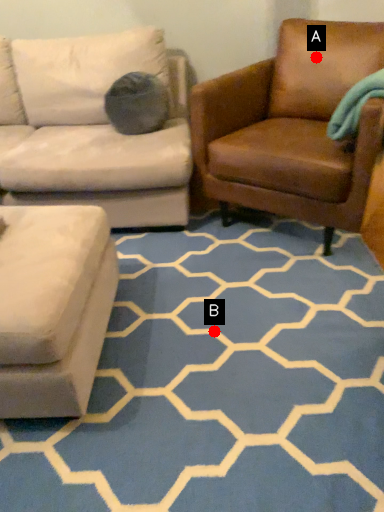
Question: Two points are circled on the image, labeled by A and B beside each circle. Which of the following is the closest to the observer?

Choices:
 (A) A is closer
 (B) B is closer

Answer: (B)